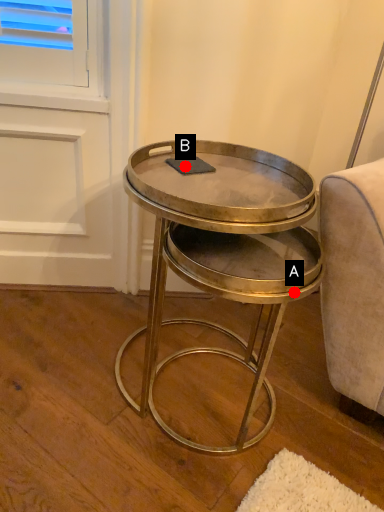
Question: Two points are circled on the image, labeled by A and B beside each circle. Among these points, which one is nearest to the camera?

Choices:
 (A) A is closer
 (B) B is closer

Answer: (A)